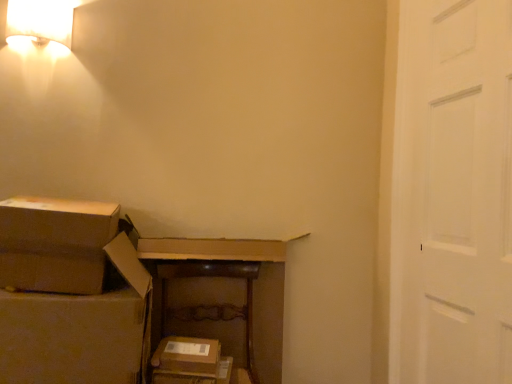
Question: From a real-world perspective, is brown cardboard box at center, which ranks as the 2th storage box in top-to-bottom order, positioned under brown wooden dresser at center based on gravity?

Choices:
 (A) no
 (B) yes

Answer: (B)

Question: Considering the relative sizes of brown cardboard box at center, which ranks as the 2th storage box in top-to-bottom order, and brown wooden dresser at center in the image provided, is brown cardboard box at center, which ranks as the 2th storage box in top-to-bottom order, thinner than brown wooden dresser at center?

Choices:
 (A) yes
 (B) no

Answer: (B)

Question: Is brown cardboard box at center, positioned as the first storage box in bottom-to-top order, at the right side of brown wooden dresser at center?

Choices:
 (A) no
 (B) yes

Answer: (A)

Question: Is brown cardboard box at center, placed as the 2th storage box when sorted from left to right, bigger than brown wooden dresser at center?

Choices:
 (A) no
 (B) yes

Answer: (A)

Question: From a real-world perspective, is brown cardboard box at center, positioned as the first storage box in bottom-to-top order, on brown wooden dresser at center?

Choices:
 (A) no
 (B) yes

Answer: (A)

Question: From the image's perspective, relative to brown cardboard box at center, which ranks as the 2th storage box in top-to-bottom order, is brown wooden dresser at center above or below?

Choices:
 (A) below
 (B) above

Answer: (B)

Question: Is brown wooden dresser at center taller or shorter than brown cardboard box at center, placed as the 2th storage box when sorted from left to right?

Choices:
 (A) short
 (B) tall

Answer: (B)

Question: Does point (178, 297) appear closer or farther from the camera than point (162, 382)?

Choices:
 (A) closer
 (B) farther

Answer: (B)

Question: Looking at the image, does brown wooden dresser at center seem bigger or smaller compared to brown cardboard box at center, which ranks as the 2th storage box in top-to-bottom order?

Choices:
 (A) small
 (B) big

Answer: (B)

Question: Considering the positions of white fabric lampshade at upper left and brown wooden dresser at center in the image, is white fabric lampshade at upper left wider or thinner than brown wooden dresser at center?

Choices:
 (A) thin
 (B) wide

Answer: (A)

Question: In the image, is white fabric lampshade at upper left positioned in front of or behind brown wooden dresser at center?

Choices:
 (A) front
 (B) behind

Answer: (A)

Question: Based on their sizes in the image, would you say white fabric lampshade at upper left is bigger or smaller than brown wooden dresser at center?

Choices:
 (A) big
 (B) small

Answer: (B)

Question: Do you think white fabric lampshade at upper left is within brown wooden dresser at center, or outside of it?

Choices:
 (A) inside
 (B) outside

Answer: (B)

Question: In terms of height, does brown cardboard box at left, which is counted as the second storage box, starting from the bottom, look taller or shorter compared to white fabric lampshade at upper left?

Choices:
 (A) tall
 (B) short

Answer: (A)

Question: From the image's perspective, is brown cardboard box at left, which is counted as the second storage box, starting from the bottom, above or below white fabric lampshade at upper left?

Choices:
 (A) above
 (B) below

Answer: (B)